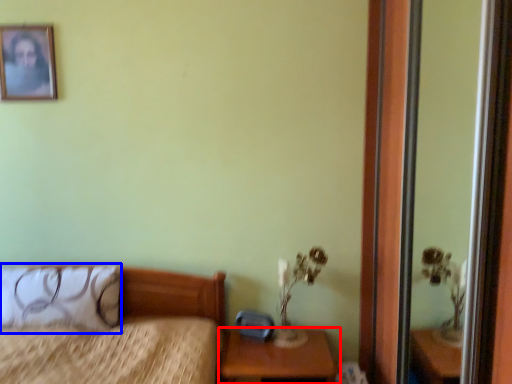
Question: Which object is closer to the camera taking this photo, nightstand (highlighted by a red box) or pillow (highlighted by a blue box)?

Choices:
 (A) nightstand
 (B) pillow

Answer: (A)